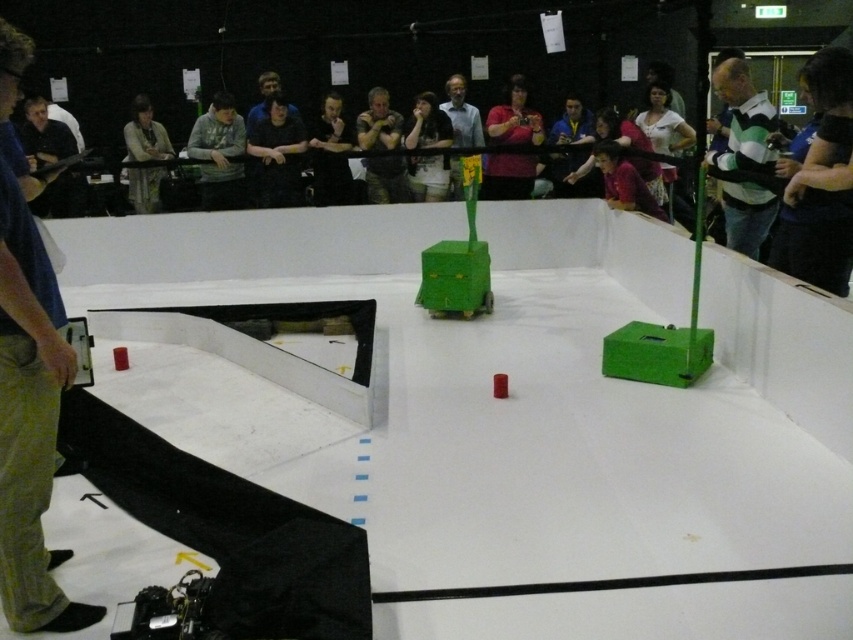
Is blue jeans at left above black matte shirt at upper center?

No, blue jeans at left is not above black matte shirt at upper center.

Based on the photo, is blue jeans at left smaller than black matte shirt at upper center?

No, blue jeans at left is not smaller than black matte shirt at upper center.

This screenshot has width=853, height=640. In order to click on blue jeans at left in this screenshot , I will do `click(30, 420)`.

Locate an element on the screen. blue jeans at left is located at coordinates (30, 420).

Between blue jeans at left and gray matte jacket at upper center, which one appears on the left side from the viewer's perspective?

gray matte jacket at upper center is more to the left.

Where is `blue jeans at left`? Image resolution: width=853 pixels, height=640 pixels. blue jeans at left is located at coordinates (30, 420).

Which is in front, point (86, 614) or point (209, 138)?

Point (86, 614) is in front.

Locate an element on the screen. This screenshot has width=853, height=640. blue jeans at left is located at coordinates (30, 420).

Does blue jeans at left come behind black matte shirt at center?

No, it is not.

Does blue jeans at left have a larger size compared to black matte shirt at center?

Incorrect, blue jeans at left is not larger than black matte shirt at center.

Which is in front, point (33, 488) or point (317, 163)?

Point (33, 488) is in front.

The height and width of the screenshot is (640, 853). I want to click on blue jeans at left, so click(x=30, y=420).